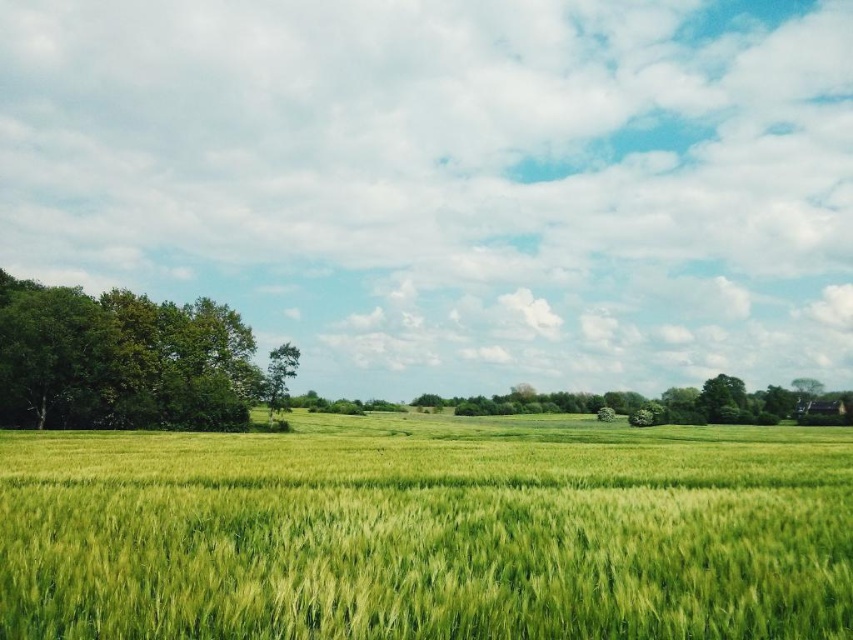
You are standing in the middle of the green grassy wheat field at center and want to walk towards the green leafy tree at left. Which direction should you head?

The green grassy wheat field at center is in front of the green leafy tree at left, so you should head towards the left direction to reach the tree.

You are standing at the origin point in the rural landscape. The green grassy wheat field at center is marked at coordinates 0.833 on the x and 0.503 on the y. If you want to walk directly towards the wheat field, which direction should you head?

The green grassy wheat field at center is located at coordinates 0.833 on the x and 0.503 on the y. Since you are at the origin point, you should move towards the positive x and y directions to reach it.